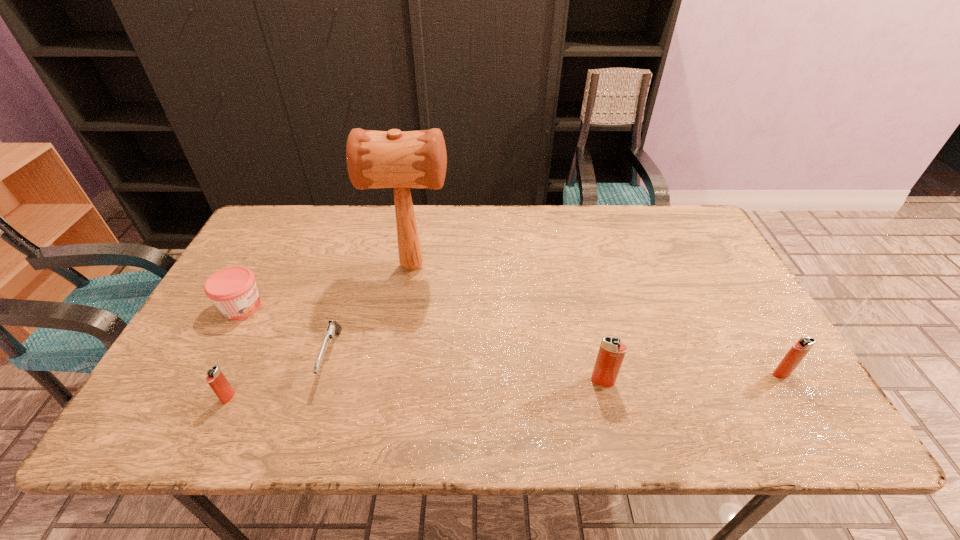
Where is `the third closest object to the pistol`? This screenshot has width=960, height=540. the third closest object to the pistol is located at coordinates (233, 290).

The height and width of the screenshot is (540, 960). What are the coordinates of `igniter object that ranks as the closest to the tallest object` in the screenshot? It's located at (217, 381).

Identify which igniter is the third nearest to the second farthest object. Please provide its 2D coordinates. Your answer should be formatted as a tuple, i.e. [(x, y)], where the tuple contains the x and y coordinates of a point satisfying the conditions above.

[(799, 350)]

The height and width of the screenshot is (540, 960). Find the location of `vacant space that satisfies the following two spatial constraints: 1. on the front-facing side of the second igniter from left to right; 2. on the left side of the shortest object`. vacant space that satisfies the following two spatial constraints: 1. on the front-facing side of the second igniter from left to right; 2. on the left side of the shortest object is located at coordinates (324, 381).

Where is `free space that satisfies the following two spatial constraints: 1. on the strike surface of the mallet; 2. on the left side of the second igniter from left to right`? free space that satisfies the following two spatial constraints: 1. on the strike surface of the mallet; 2. on the left side of the second igniter from left to right is located at coordinates (393, 381).

In order to click on vacant region that satisfies the following two spatial constraints: 1. on the front label of the second farthest object; 2. on the back side of the second tallest object in this screenshot , I will do `click(202, 381)`.

Where is `free location that satisfies the following two spatial constraints: 1. on the front-facing side of the second shortest igniter; 2. on the left side of the pistol`? The image size is (960, 540). free location that satisfies the following two spatial constraints: 1. on the front-facing side of the second shortest igniter; 2. on the left side of the pistol is located at coordinates (326, 374).

Identify the location of free space that satisfies the following two spatial constraints: 1. on the front-facing side of the pistol; 2. on the right side of the second igniter from left to right. (324, 381).

Find the location of a particular element. free spot that satisfies the following two spatial constraints: 1. on the strike surface of the tallest igniter; 2. on the right side of the mallet is located at coordinates (393, 381).

I want to click on free spot that satisfies the following two spatial constraints: 1. on the back side of the second object from left to right; 2. on the front label of the jam, so tap(272, 307).